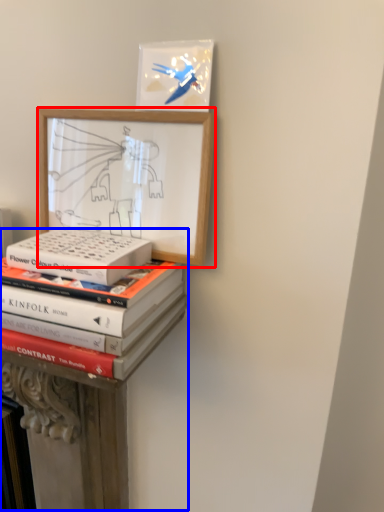
Question: Which object is closer to the camera taking this photo, picture frame (highlighted by a red box) or bookshelf (highlighted by a blue box)?

Choices:
 (A) picture frame
 (B) bookshelf

Answer: (A)